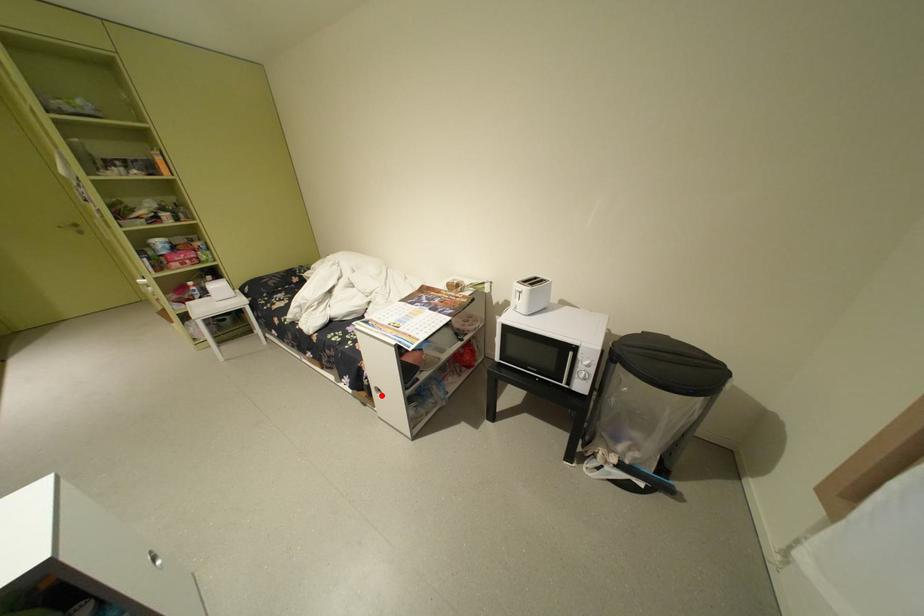
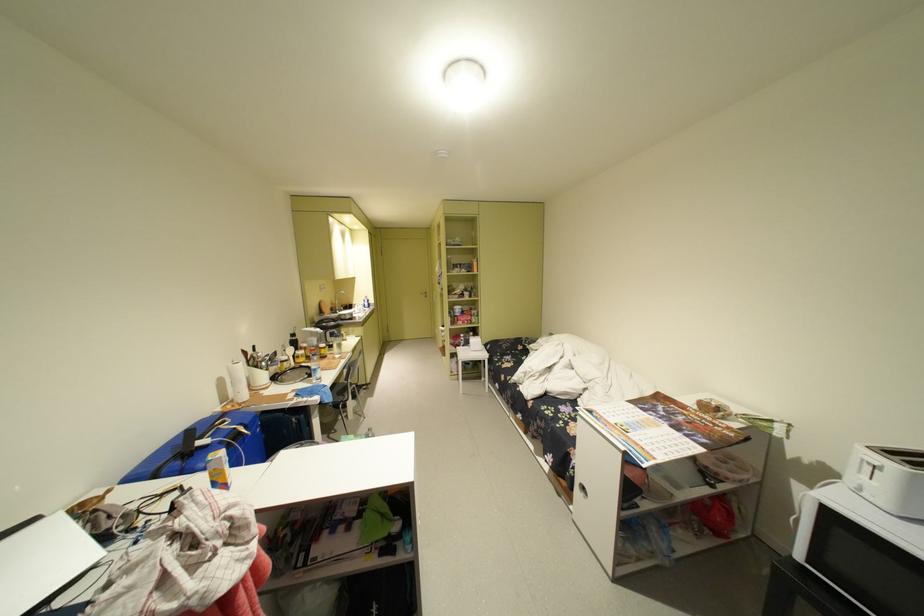
Locate, in the second image, the point that corresponds to the highlighted location in the first image.

(582, 488)